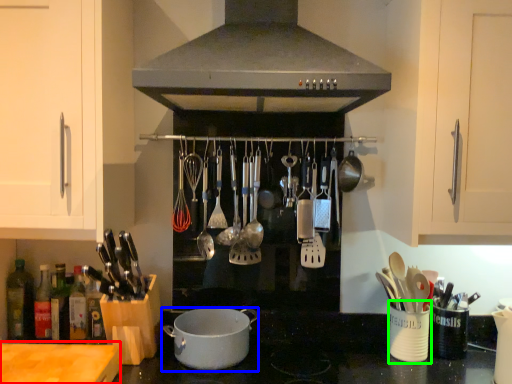
Question: Estimate the real-world distances between objects in this image. Which object is closer to counter top (highlighted by a red box), kitchen appliance (highlighted by a blue box) or appliance (highlighted by a green box)?

Choices:
 (A) kitchen appliance
 (B) appliance

Answer: (A)